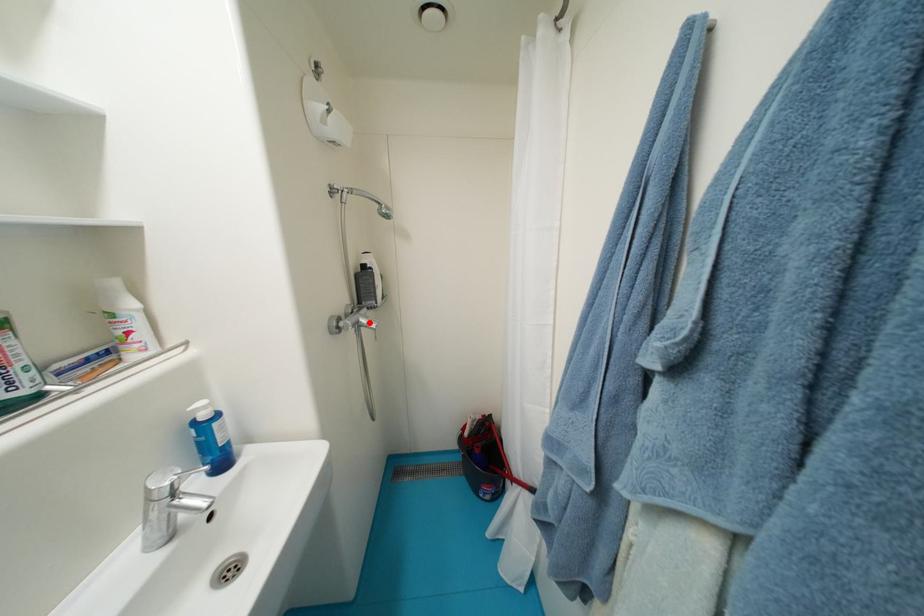
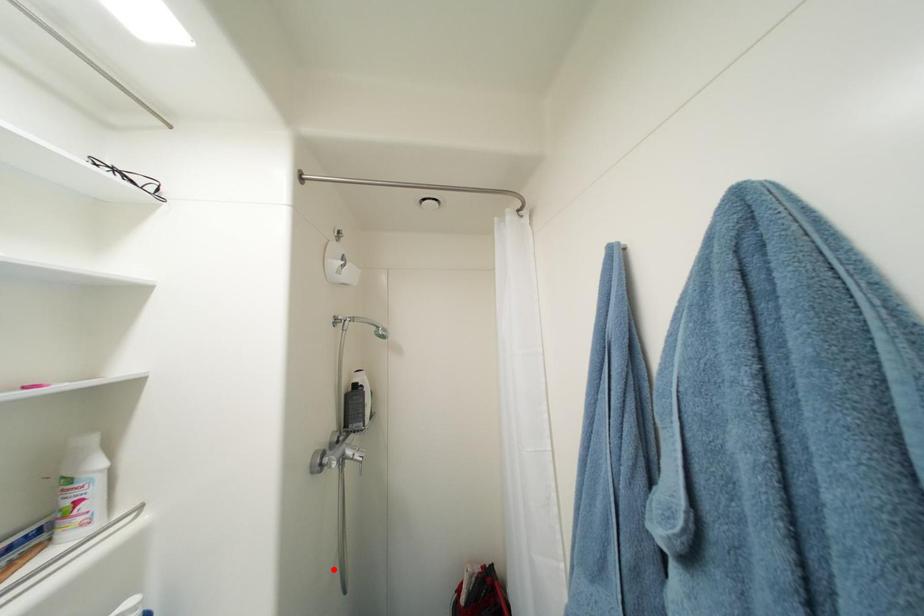
I am providing you with two images of the same scene from different viewpoints. A red point is marked on the first image and another point is marked on the second image. Is the red point in image1 aligned with the point shown in image2?

No